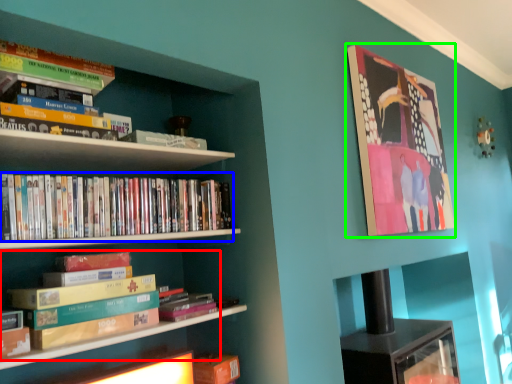
Question: Which is nearer to the book (highlighted by a red box)? book (highlighted by a blue box) or picture frame (highlighted by a green box).

Choices:
 (A) book
 (B) picture frame

Answer: (A)